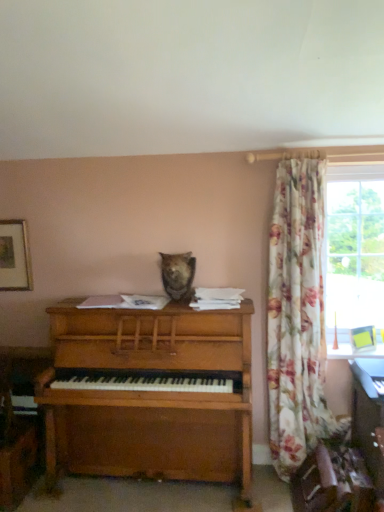
You are a GUI agent. You are given a task and a screenshot of the screen. Output one action in this format:
    pyautogui.click(x=<x>, y=<y>)
    Task: Click on the fuzzy brown bear at center
    
    Given the screenshot: What is the action you would take?
    pyautogui.click(x=178, y=275)

Is wooden piano at center aimed at wooden desk at lower right?

No, wooden piano at center is not turned towards wooden desk at lower right.

From a real-world perspective, who is located lower, wooden piano at center or wooden desk at lower right?

In real-world perspective, wooden desk at lower right is lower.

The image size is (384, 512). In order to click on piano above the wooden desk at lower right (from the image's perspective) in this screenshot , I will do `click(149, 395)`.

This screenshot has height=512, width=384. What are the coordinates of `animal above the wooden piano at center (from the image's perspective)` in the screenshot? It's located at (178, 275).

From the image's perspective, between wooden piano at center and fuzzy brown bear at center, who is located below?

wooden piano at center appears lower in the image.

How different are the orientations of wooden piano at center and fuzzy brown bear at center in degrees?

3.42 degrees separate the facing orientations of wooden piano at center and fuzzy brown bear at center.

How far apart are wooden framed picture at upper left and fuzzy brown bear at center?

3.44 feet.

Does wooden framed picture at upper left have a larger size compared to fuzzy brown bear at center?

Actually, wooden framed picture at upper left might be smaller than fuzzy brown bear at center.

Which point is more distant from viewer, (13, 260) or (179, 297)?

The point (13, 260) is farther from the camera.

Does wooden framed picture at upper left turn towards fuzzy brown bear at center?

No, wooden framed picture at upper left is not aimed at fuzzy brown bear at center.

Is point (320, 379) in front of point (359, 436)?

No, it is not.

Could you tell me if floral fabric curtain at right is turned towards wooden desk at lower right?

Yes.

Is floral fabric curtain at right beside wooden desk at lower right?

floral fabric curtain at right and wooden desk at lower right are clearly separated.

Can you confirm if floral fabric curtain at right is thinner than wooden desk at lower right?

Incorrect, the width of floral fabric curtain at right is not less than that of wooden desk at lower right.

Would you say fuzzy brown bear at center is inside or outside floral fabric curtain at right?

fuzzy brown bear at center is spatially situated outside floral fabric curtain at right.

In the image, there is a fuzzy brown bear at center. Where is `curtain below it (from a real-world perspective)`? curtain below it (from a real-world perspective) is located at coordinates (297, 316).

Is fuzzy brown bear at center aimed at floral fabric curtain at right?

No, fuzzy brown bear at center is not turned towards floral fabric curtain at right.

Can you confirm if fuzzy brown bear at center is bigger than floral fabric curtain at right?

Actually, fuzzy brown bear at center might be smaller than floral fabric curtain at right.

Which of these two, wooden desk at lower right or wooden framed picture at upper left, is bigger?

Bigger between the two is wooden desk at lower right.

Which object is thinner, wooden desk at lower right or wooden framed picture at upper left?

With smaller width is wooden framed picture at upper left.

Is wooden desk at lower right inside or outside of wooden framed picture at upper left?

wooden desk at lower right lies outside wooden framed picture at upper left.

Is wooden piano at center far from wooden framed picture at upper left?

No, wooden piano at center is not far from wooden framed picture at upper left.

From a real-world perspective, is wooden piano at center on top of wooden framed picture at upper left?

No, from a real-world perspective, wooden piano at center is not on top of wooden framed picture at upper left.

Which is correct: wooden piano at center is inside wooden framed picture at upper left, or outside of it?

wooden piano at center is not inside wooden framed picture at upper left, it's outside.

Who is bigger, wooden piano at center or wooden framed picture at upper left?

Bigger between the two is wooden piano at center.

Where is `computer desk in front of the wooden piano at center`? Image resolution: width=384 pixels, height=512 pixels. computer desk in front of the wooden piano at center is located at coordinates (369, 415).

I want to click on animal behind the wooden piano at center, so click(x=178, y=275).

From the image, which object appears to be farther from wooden piano at center, wooden desk at lower right or fuzzy brown bear at center?

wooden desk at lower right lies further to wooden piano at center than the other object.

Which object lies nearer to the anchor point fuzzy brown bear at center, wooden framed picture at upper left or wooden desk at lower right?

wooden framed picture at upper left is positioned closer to the anchor fuzzy brown bear at center.

When comparing their distances from wooden framed picture at upper left, does floral fabric curtain at right or fuzzy brown bear at center seem closer?

fuzzy brown bear at center is positioned closer to the anchor wooden framed picture at upper left.

Based on their spatial positions, is wooden piano at center or fuzzy brown bear at center further from wooden framed picture at upper left?

Based on the image, fuzzy brown bear at center appears to be further to wooden framed picture at upper left.

Which object lies nearer to the anchor point wooden desk at lower right, floral fabric curtain at right or wooden framed picture at upper left?

The object closer to wooden desk at lower right is floral fabric curtain at right.

Looking at the image, which one is located further to wooden desk at lower right, wooden framed picture at upper left or wooden piano at center?

wooden framed picture at upper left lies further to wooden desk at lower right than the other object.

Considering their positions, is wooden desk at lower right positioned further to wooden framed picture at upper left than fuzzy brown bear at center?

The object further to wooden framed picture at upper left is wooden desk at lower right.

Considering their positions, is wooden desk at lower right positioned closer to wooden piano at center than floral fabric curtain at right?

Among the two, floral fabric curtain at right is located nearer to wooden piano at center.

Where is `animal between wooden framed picture at upper left and wooden desk at lower right`? animal between wooden framed picture at upper left and wooden desk at lower right is located at coordinates (178, 275).

Where is `piano between wooden framed picture at upper left and floral fabric curtain at right from left to right`? This screenshot has width=384, height=512. piano between wooden framed picture at upper left and floral fabric curtain at right from left to right is located at coordinates (149, 395).

Find the location of `piano between wooden framed picture at upper left and wooden desk at lower right in the horizontal direction`. piano between wooden framed picture at upper left and wooden desk at lower right in the horizontal direction is located at coordinates (149, 395).

At what (x,y) coordinates should I click in order to perform the action: click on animal between wooden framed picture at upper left and floral fabric curtain at right. Please return your answer as a coordinate pair (x, y). The width and height of the screenshot is (384, 512). Looking at the image, I should click on (178, 275).